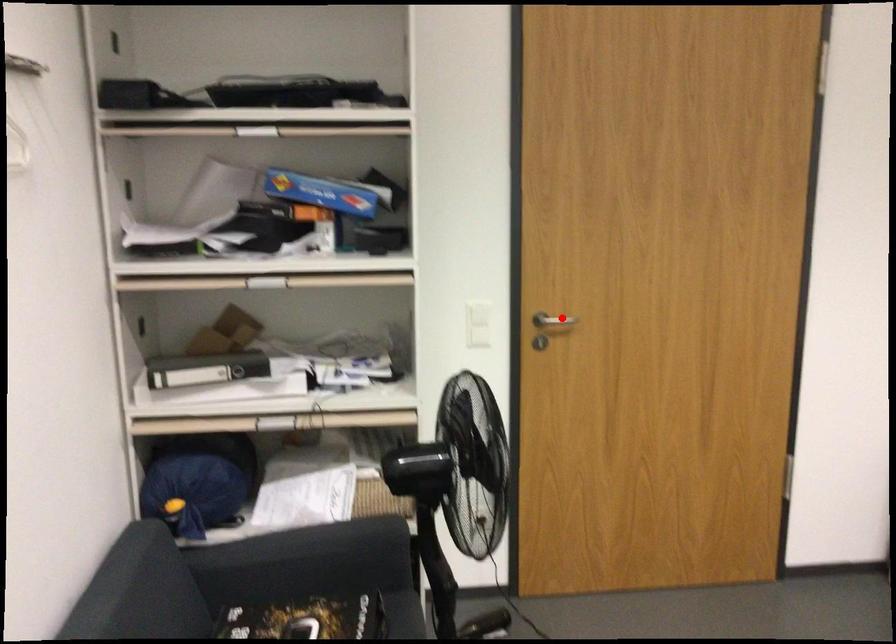
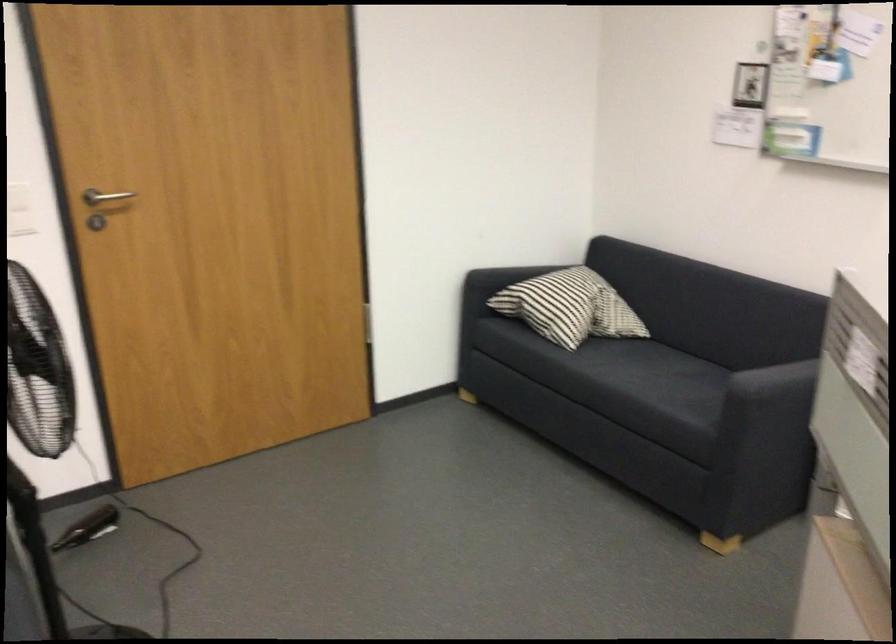
The point at the highlighted location is marked in the first image. Where is the corresponding point in the second image?

(105, 196)